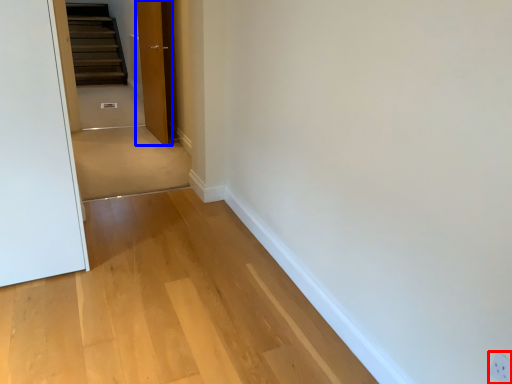
Question: Which object is closer to the camera taking this photo, electric outlet (highlighted by a red box) or door (highlighted by a blue box)?

Choices:
 (A) electric outlet
 (B) door

Answer: (A)